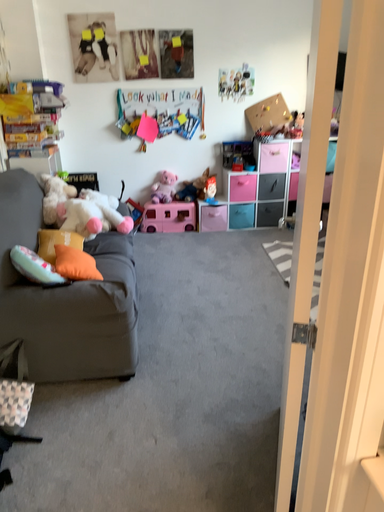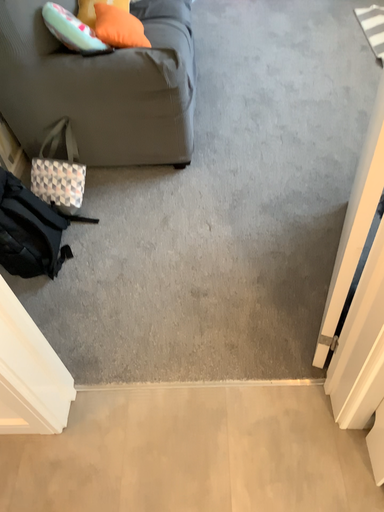
Question: How did the camera likely rotate when shooting the video?

Choices:
 (A) rotated downward
 (B) rotated upward

Answer: (A)